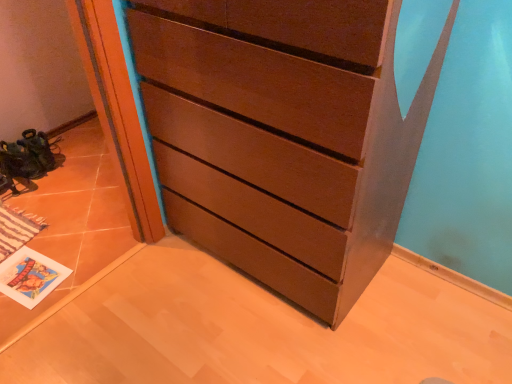
I want to click on vacant point to the left of matte brown chest of drawers at center, so click(x=146, y=299).